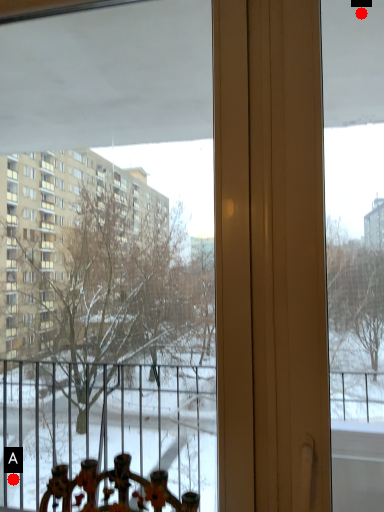
Question: Two points are circled on the image, labeled by A and B beside each circle. Which point appears farthest from the camera in this image?

Choices:
 (A) A is further
 (B) B is further

Answer: (A)